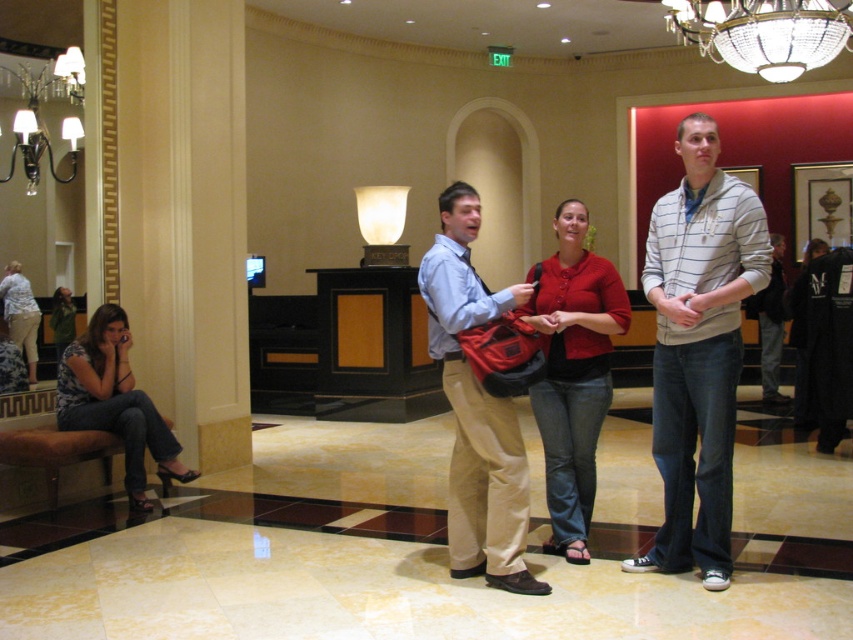
You are a photographer setting up a shoot in this lobby. You need to ensure that the striped cotton hoodie at center and the matte red sweater at center are both visible in the frame. Given that the camera can only focus on items above a certain height, which of the two items should you prioritize to ensure it stays in focus?

The striped cotton hoodie at center has a greater height compared to the matte red sweater at center, so you should prioritize keeping the striped cotton hoodie at center in focus since it is taller and more likely to stay within the camera focus range.

From the picture: You are standing in the hotel lobby and need to hand a document to the person wearing the matte blue shirt at center. If you can reach up to 2 meters, can you hand the document without moving closer?

The matte blue shirt at center is 3.33 meters away from the viewer, which is beyond your 2 meters reach. You need to move closer to hand the document.

You are standing in the hotel lobby and want to find the person wearing the matte blue shirt at center. According to the coordinates provided, where should you look to find this person?

The matte blue shirt at center is located at the coordinates point (476, 408), so you should look towards the center area of the image to find the person wearing it.